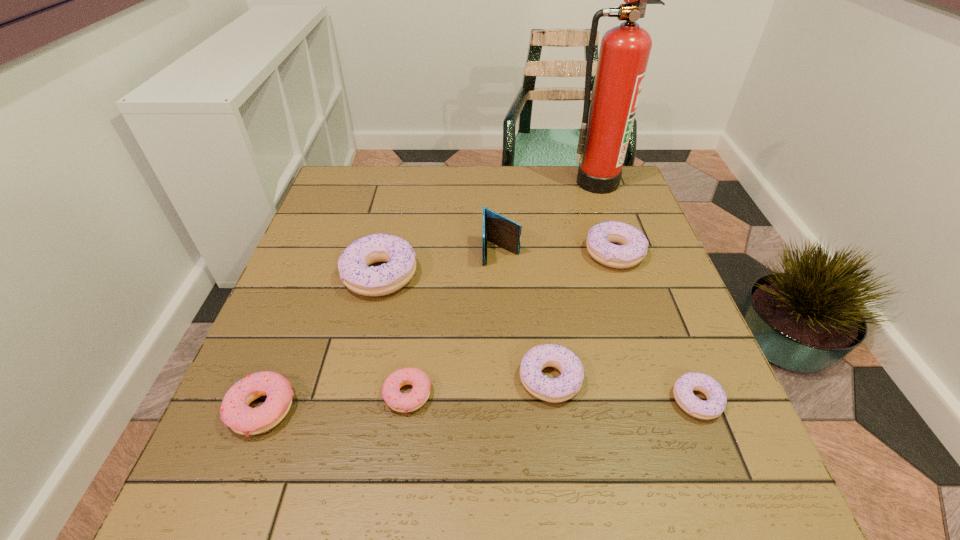
This screenshot has width=960, height=540. I want to click on free spot located on the front of the smallest purple doughnut, so click(716, 450).

Identify the location of free spot located 0.070m on the front of the smaller pink doughnut. The width and height of the screenshot is (960, 540). (399, 455).

I want to click on object that is at the far edge, so click(x=624, y=52).

Identify the location of fire extinguisher at the right edge. (624, 52).

The image size is (960, 540). Identify the location of object that is at the far right corner. (624, 52).

In the image, there is a desktop. Identify the location of vacant space at the far edge. (468, 174).

Where is `free space at the left edge of the desktop`? free space at the left edge of the desktop is located at coordinates (344, 240).

Image resolution: width=960 pixels, height=540 pixels. What are the coordinates of `blank space at the right edge` in the screenshot? It's located at (632, 306).

In the image, there is a desktop. Where is `vacant space at the far left corner`? This screenshot has width=960, height=540. vacant space at the far left corner is located at coordinates (371, 172).

This screenshot has width=960, height=540. In the image, there is a desktop. In order to click on vacant space at the near left corner in this screenshot , I will do `click(201, 477)`.